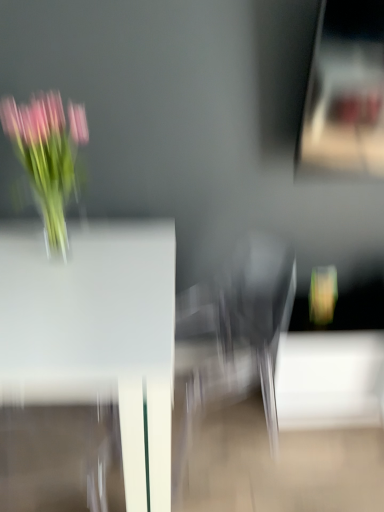
Question: Considering their positions, is white glossy table at center located in front of or behind pink glass vase at left?

Choices:
 (A) front
 (B) behind

Answer: (A)

Question: From the image's perspective, is white glossy table at center located above or below pink glass vase at left?

Choices:
 (A) above
 (B) below

Answer: (B)

Question: Is white glossy table at center taller or shorter than pink glass vase at left?

Choices:
 (A) tall
 (B) short

Answer: (A)

Question: From the image's perspective, is pink glass vase at left above or below white glossy table at center?

Choices:
 (A) above
 (B) below

Answer: (A)

Question: Visually, is pink glass vase at left positioned to the left or to the right of white glossy table at center?

Choices:
 (A) right
 (B) left

Answer: (A)

Question: Considering the positions of pink glass vase at left and white glossy table at center in the image, is pink glass vase at left wider or thinner than white glossy table at center?

Choices:
 (A) wide
 (B) thin

Answer: (B)

Question: From a real-world perspective, is pink glass vase at left above or below white glossy table at center?

Choices:
 (A) above
 (B) below

Answer: (A)